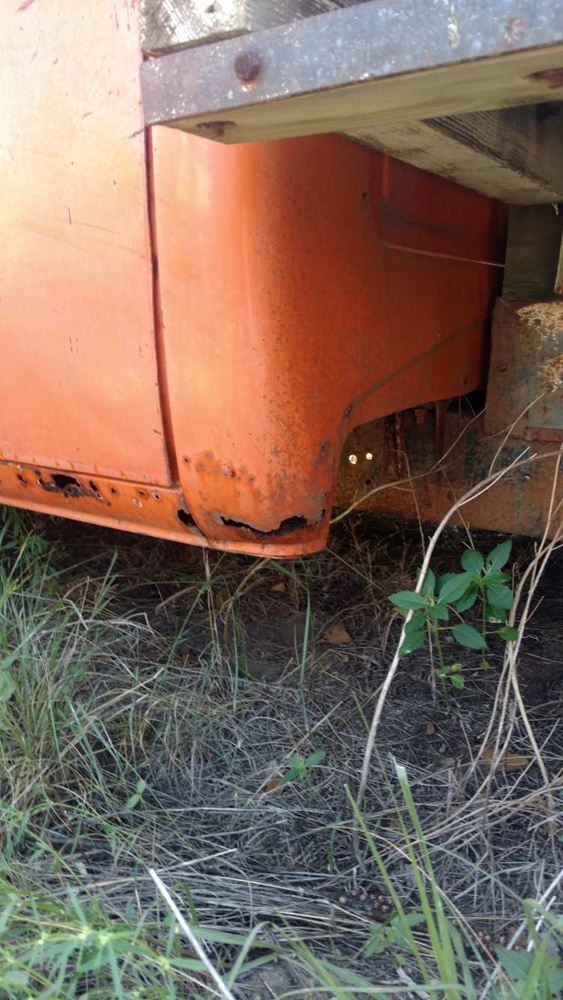
This screenshot has height=1000, width=563. Identify the location of plant. (417, 623).